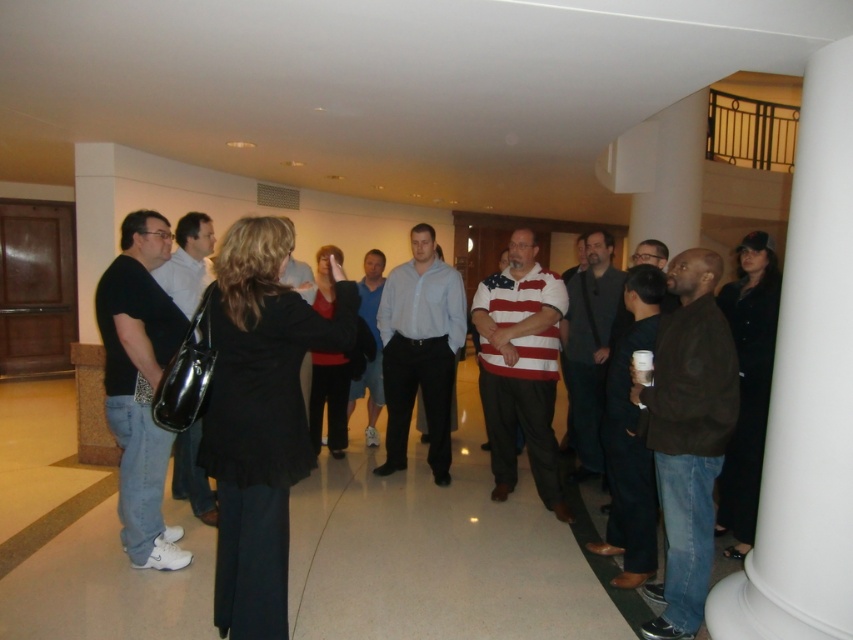
Question: Which point appears farthest from the camera in this image?

Choices:
 (A) (148, 246)
 (B) (666, 324)
 (C) (451, 381)

Answer: (C)

Question: Does white smooth column at right have a greater width compared to black matte shirt at left?

Choices:
 (A) no
 (B) yes

Answer: (A)

Question: Does black matte blazer at center appear on the right side of striped cotton shirt at center?

Choices:
 (A) yes
 (B) no

Answer: (B)

Question: Which object appears farthest from the camera in this image?

Choices:
 (A) striped cotton shirt at center
 (B) white smooth column at right
 (C) matte white shirt at center

Answer: (C)

Question: Is white smooth column at right smaller than striped cotton shirt at center?

Choices:
 (A) no
 (B) yes

Answer: (B)

Question: Which of the following is the closest to the observer?

Choices:
 (A) (683, 438)
 (B) (238, 561)

Answer: (B)